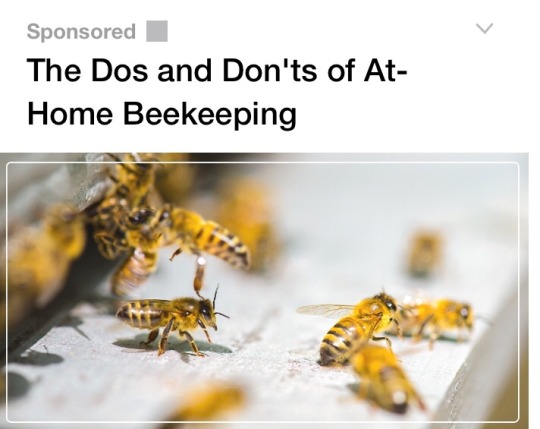
Where is `wall`? The image size is (540, 429). wall is located at coordinates (24, 190).